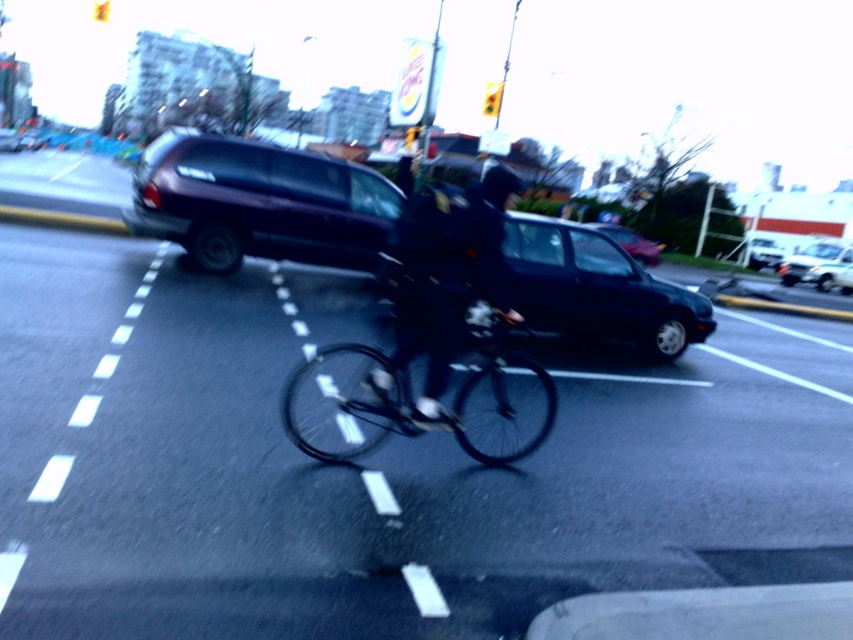
You are a delivery driver who needs to pass the dark blue matte suv at center and the black matte bicycle at center on a narrow road. Can you safely maneuver around them without hitting either?

The dark blue matte suv at center is taller than the black matte bicycle at center, so you can safely maneuver around them as long as you account for the height difference and ensure there is enough space to pass both vehicles on the narrow road.

You are a pedestrian trying to cross the road and see the dark blue jeans at center and the white glossy suv at center. Which object is closer to the left side of the road?

The dark blue jeans at center are closer to the left side of the road since they are positioned to the left of the white glossy suv at center.